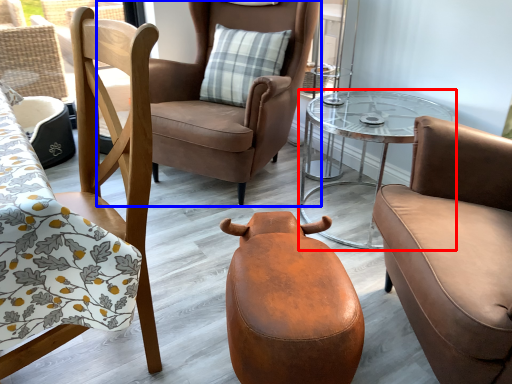
Question: Among these objects, which one is nearest to the camera, table (highlighted by a red box) or chair (highlighted by a blue box)?

Choices:
 (A) table
 (B) chair

Answer: (A)